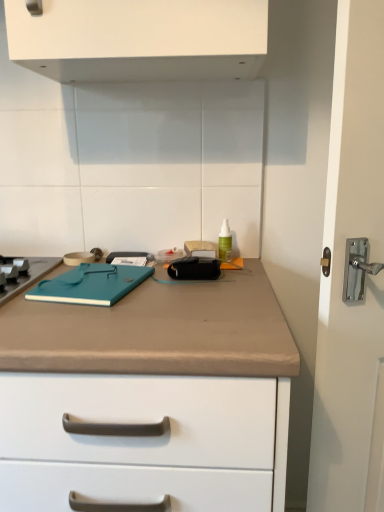
Question: From a real-world perspective, is teal matte notebook at center physically above green translucent bottle at center?

Choices:
 (A) no
 (B) yes

Answer: (A)

Question: Is green translucent bottle at center surrounded by teal matte notebook at center?

Choices:
 (A) no
 (B) yes

Answer: (A)

Question: Is teal matte notebook at center positioned with its back to green translucent bottle at center?

Choices:
 (A) yes
 (B) no

Answer: (B)

Question: Is teal matte notebook at center bigger than green translucent bottle at center?

Choices:
 (A) no
 (B) yes

Answer: (B)

Question: Considering the relative sizes of teal matte notebook at center and green translucent bottle at center in the image provided, is teal matte notebook at center wider than green translucent bottle at center?

Choices:
 (A) no
 (B) yes

Answer: (B)

Question: From a real-world perspective, is green translucent bottle at center positioned above or below teal matte notebook at center?

Choices:
 (A) below
 (B) above

Answer: (B)

Question: In terms of width, does green translucent bottle at center look wider or thinner when compared to teal matte notebook at center?

Choices:
 (A) wide
 (B) thin

Answer: (B)

Question: Considering their positions, is green translucent bottle at center located in front of or behind teal matte notebook at center?

Choices:
 (A) front
 (B) behind

Answer: (B)

Question: From their relative heights in the image, would you say green translucent bottle at center is taller or shorter than teal matte notebook at center?

Choices:
 (A) short
 (B) tall

Answer: (B)

Question: From their relative heights in the image, would you say teal matte notebook at center is taller or shorter than green translucent bottle at center?

Choices:
 (A) short
 (B) tall

Answer: (A)

Question: Is teal matte notebook at center wider or thinner than green translucent bottle at center?

Choices:
 (A) thin
 (B) wide

Answer: (B)

Question: Is point (115, 283) positioned closer to the camera than point (218, 256)?

Choices:
 (A) closer
 (B) farther

Answer: (A)

Question: Is teal matte notebook at center in front of or behind green translucent bottle at center in the image?

Choices:
 (A) behind
 (B) front

Answer: (B)

Question: Is teal matte notebook at center bigger or smaller than beige matte countertop at center?

Choices:
 (A) small
 (B) big

Answer: (A)

Question: From their relative heights in the image, would you say teal matte notebook at center is taller or shorter than beige matte countertop at center?

Choices:
 (A) tall
 (B) short

Answer: (B)